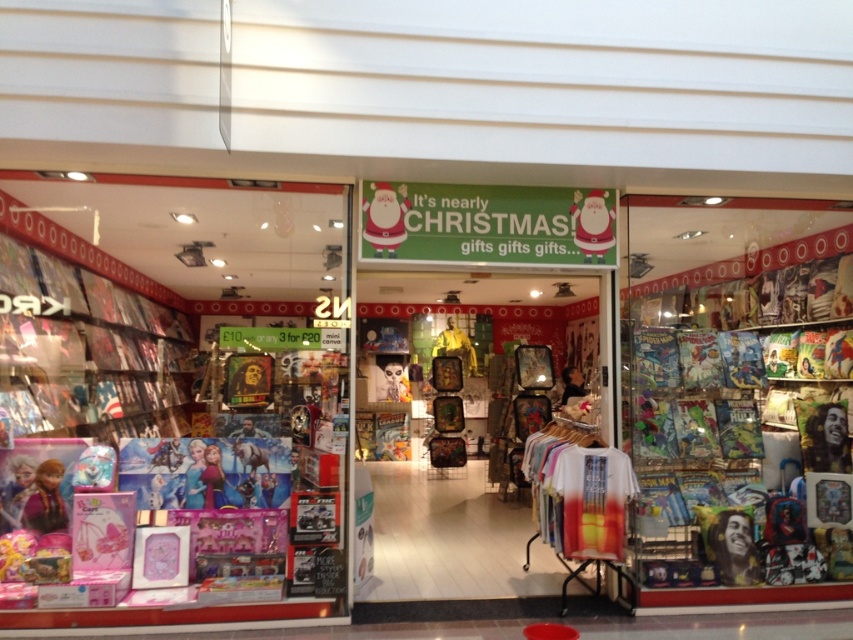
Does metallic comic books at right appear under matte plastic santa at center?

Correct, metallic comic books at right is located below matte plastic santa at center.

Between metallic comic books at right and matte plastic santa at center, which one appears on the left side from the viewer's perspective?

matte plastic santa at center is more to the left.

Image resolution: width=853 pixels, height=640 pixels. I want to click on metallic comic books at right, so click(734, 392).

Identify the location of metallic comic books at right. This screenshot has width=853, height=640. (734, 392).